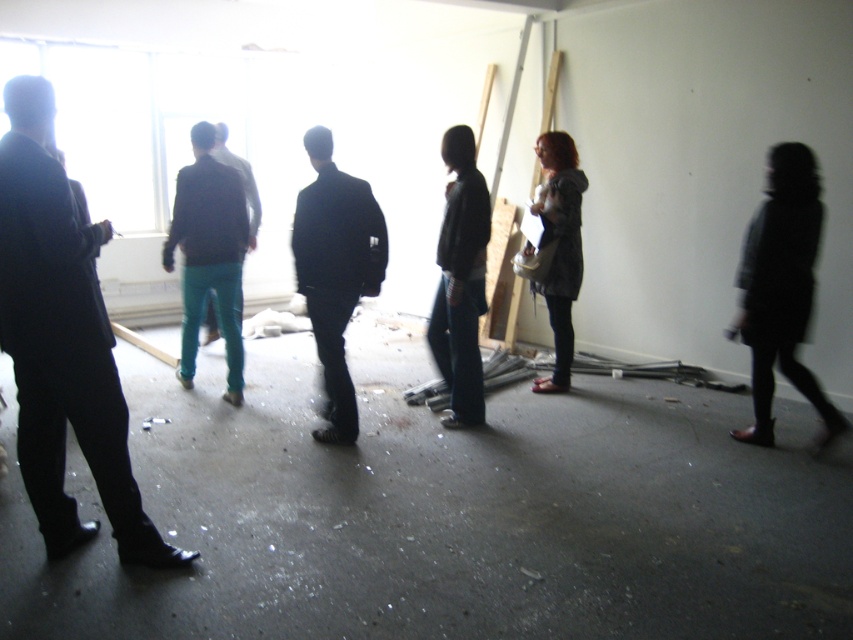
You are a contractor in the room. You need to determine which object is taller between the dark gray jacket at center and the teal pants at center. Which one is taller?

The dark gray jacket at center is taller than the teal pants at center.

Based on the photo, you are a photographer trying to capture a group photo of the people in the room. You notice the black matte suit at center and the teal pants at center. Which clothing item should you adjust to avoid overlapping with the other in the frame?

The black matte suit at center might be wider than the teal pants at center, so you should adjust the black matte suit at center to avoid overlapping with the teal pants at center.

You are a contractor standing in the room and need to move past the group. You see the black matte suit at center and the teal pants at center. Which clothing item do you need to move around more to pass through?

The teal pants at center occupies more space than the black matte suit at center, so you would need to move around the teal pants at center more to pass through.